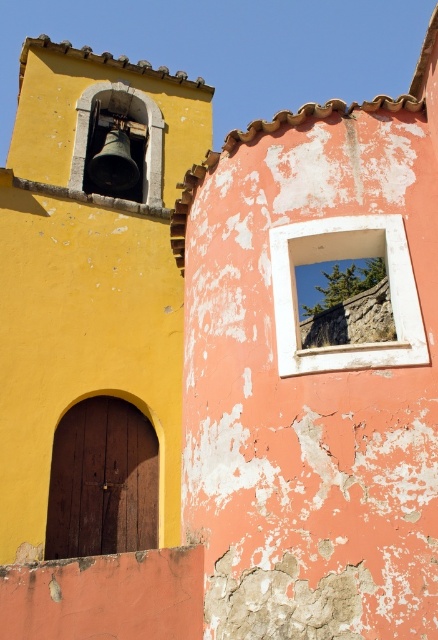
Based on the photo, does wooden door at lower left come behind white wooden window at center?

Yes, wooden door at lower left is behind white wooden window at center.

Is wooden door at lower left smaller than white wooden window at center?

Yes, wooden door at lower left is smaller than white wooden window at center.

I want to click on wooden door at lower left, so click(102, 481).

The width and height of the screenshot is (438, 640). I want to click on wooden door at lower left, so click(102, 481).

Who is lower down, white wooden window at center or metallic bell at upper left?

Positioned lower is white wooden window at center.

Does white wooden window at center appear on the left side of metallic bell at upper left?

In fact, white wooden window at center is to the right of metallic bell at upper left.

Between point (410, 364) and point (84, 138), which one is positioned in front?

Point (410, 364) is in front.

The width and height of the screenshot is (438, 640). I want to click on white wooden window at center, so click(x=339, y=259).

Can you confirm if wooden door at lower left is smaller than metallic bell at upper left?

Indeed, wooden door at lower left has a smaller size compared to metallic bell at upper left.

Is wooden door at lower left to the left of metallic bell at upper left from the viewer's perspective?

In fact, wooden door at lower left is to the right of metallic bell at upper left.

Is point (87, 509) farther from camera compared to point (84, 125)?

No, (87, 509) is closer to viewer.

I want to click on wooden door at lower left, so click(x=102, y=481).